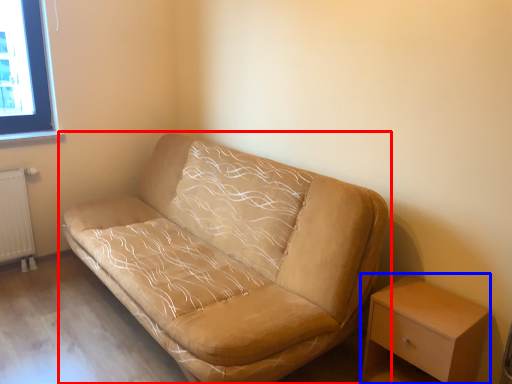
Question: Which of the following is the closest to the observer, studio couch (highlighted by a red box) or table (highlighted by a blue box)?

Choices:
 (A) studio couch
 (B) table

Answer: (A)